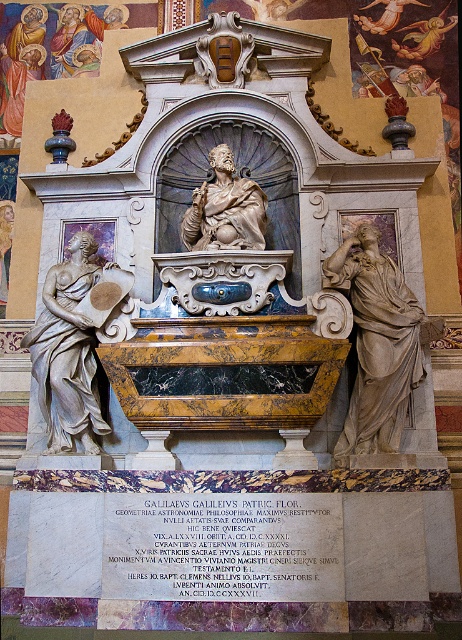
Based on the photo, measure the distance between white marble statue at left and matte stone statue at center.

28.50 feet

Which is more to the right, white marble statue at left or matte stone statue at center?

Positioned to the right is matte stone statue at center.

Measure the distance between point [50,364] and camera.

A distance of 167.03 feet exists between point [50,364] and camera.

Find the location of a particular element. Image resolution: width=462 pixels, height=640 pixels. white marble statue at left is located at coordinates (67, 353).

The width and height of the screenshot is (462, 640). Describe the element at coordinates (376, 342) in the screenshot. I see `matte stone figure at right` at that location.

Is matte stone figure at right to the right of matte stone statue at center from the viewer's perspective?

Yes, matte stone figure at right is to the right of matte stone statue at center.

Which is in front, point (380, 316) or point (206, 243)?

Positioned in front is point (380, 316).

Where is `matte stone figure at right`? matte stone figure at right is located at coordinates point(376,342).

Between matte stone figure at right and white marble statue at left, which one has more height?

Standing taller between the two is matte stone figure at right.

Which is behind, point (395, 416) or point (87, 360)?

The point (87, 360) is behind.

Find the location of a particular element. This screenshot has width=462, height=640. matte stone figure at right is located at coordinates (376, 342).